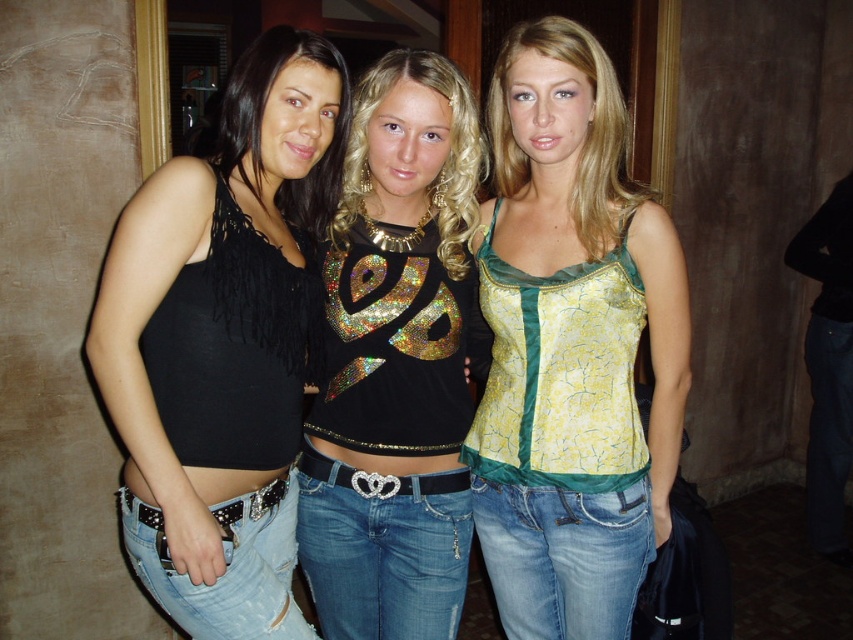
Question: From the image, what is the correct spatial relationship of black fringe tank top at left in relation to ripped denim jeans at center?

Choices:
 (A) above
 (B) below

Answer: (A)

Question: Considering the real-world distances, which object is closest to the denim jeans at center?

Choices:
 (A) ripped denim jeans at center
 (B) shiny sequined top at center

Answer: (B)

Question: Can you confirm if yellow satin tank top at center is positioned to the left of denim jeans at center?

Choices:
 (A) no
 (B) yes

Answer: (A)

Question: Among these objects, which one is farthest from the camera?

Choices:
 (A) shiny sequined top at center
 (B) denim jeans at center
 (C) jeans at center
 (D) yellow satin tank top at center

Answer: (C)

Question: Which of the following is the farthest from the observer?

Choices:
 (A) shiny sequined top at center
 (B) black fringe tank top at left

Answer: (A)

Question: Is black fringe tank top at left bigger than yellow satin tank top at center?

Choices:
 (A) yes
 (B) no

Answer: (B)